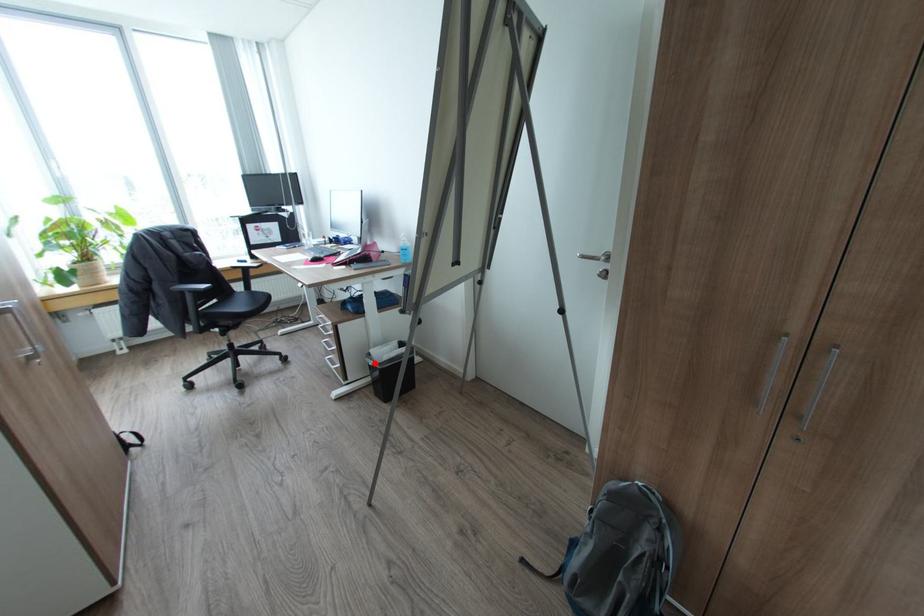
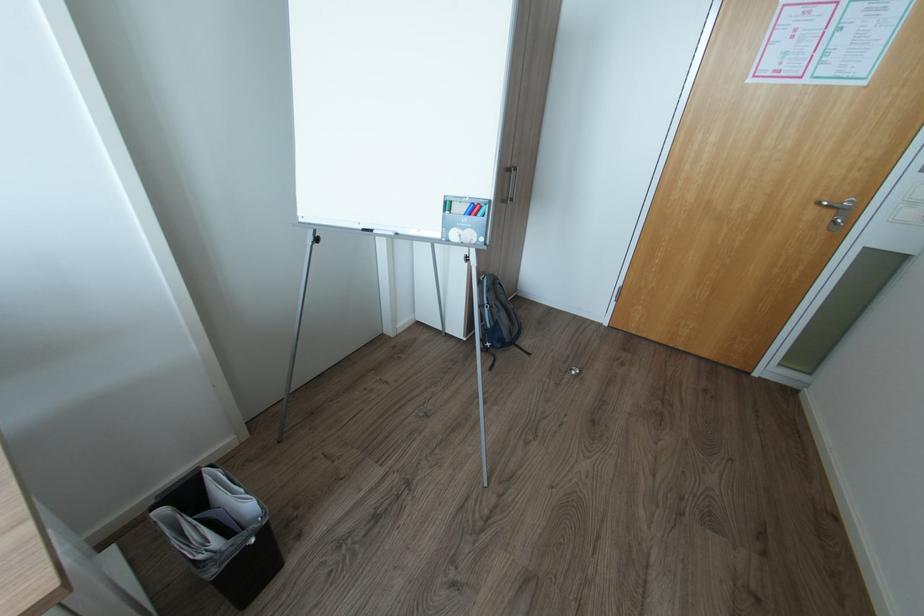
Locate, in the second image, the point that corresponds to the highlighted location in the first image.

(257, 541)